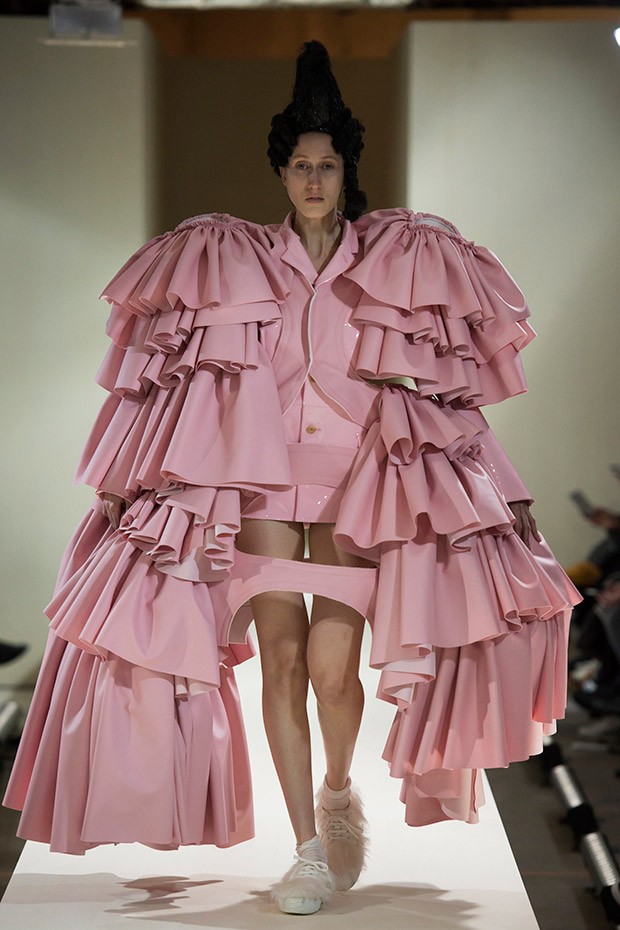
Find the location of a particular element. wall is located at coordinates point(107,191), point(554,203), point(242,163).